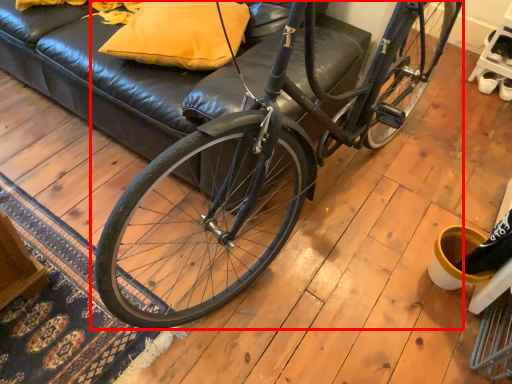
Question: Observing the image, what is the correct spatial positioning of bicycle (annotated by the red box) in reference to pillow?

Choices:
 (A) right
 (B) left

Answer: (A)